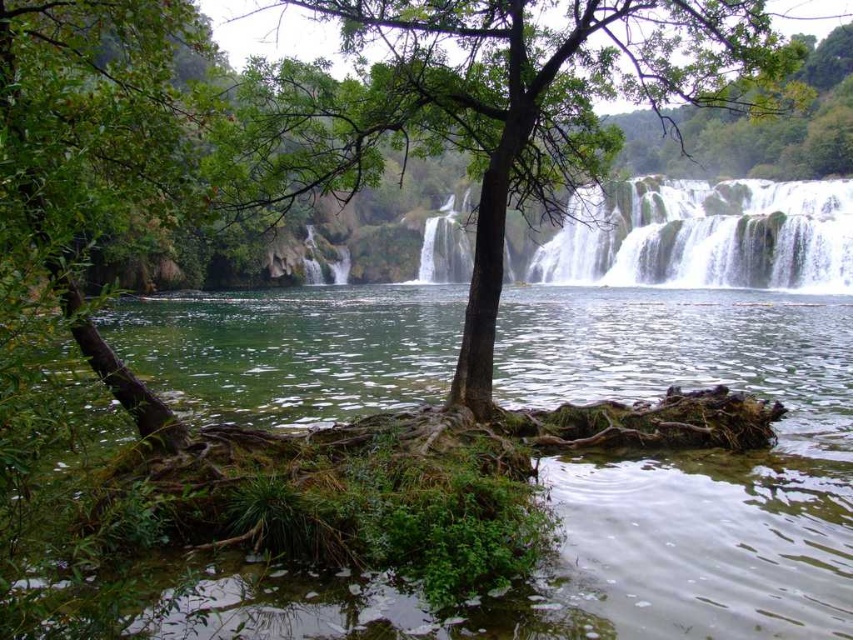
You are a hiker who wants to cross the water using the green mossy rock at center and the green leafy tree at center. Which object would be more stable to step on?

The green leafy tree at center is larger in size compared to the green mossy rock at center, so stepping on the green leafy tree at center would be more stable.

From the picture: You are standing at the point marked by the coordinates point (496,106) in the image. What object are you directly facing?

You are directly facing the green leafy tree at center, as the point (496,106) represents its location.